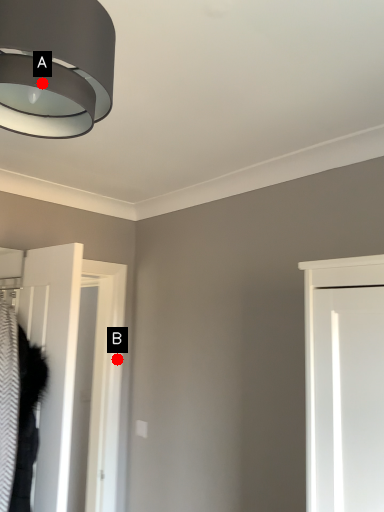
Question: Two points are circled on the image, labeled by A and B beside each circle. Which point is closer to the camera?

Choices:
 (A) A is closer
 (B) B is closer

Answer: (A)